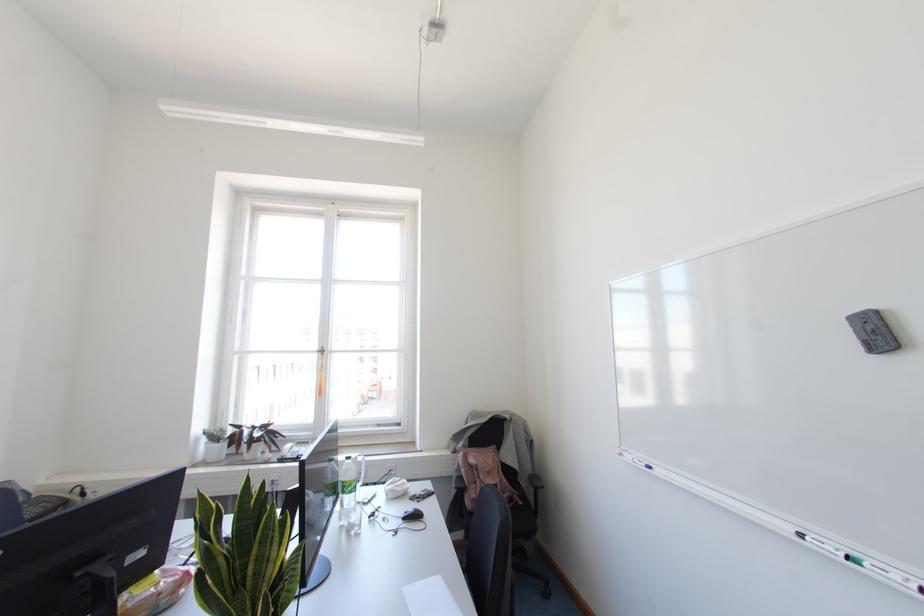
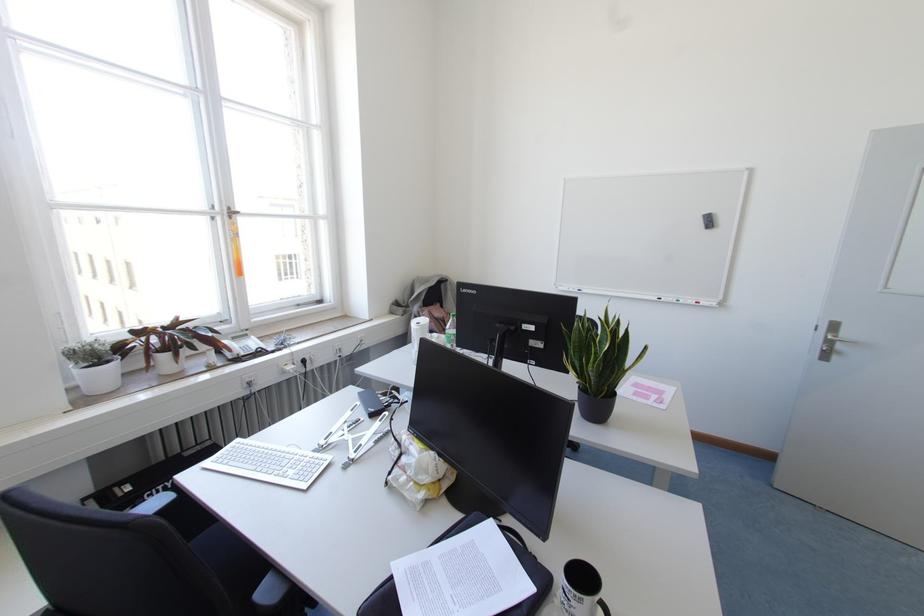
In the second image, find the point that corresponds to (x=322, y=353) in the first image.

(229, 217)